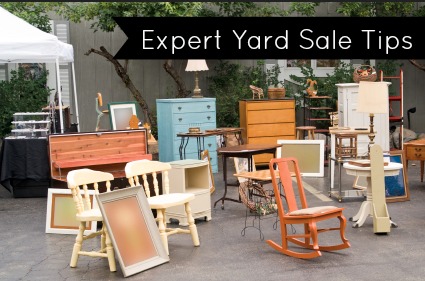
Find the location of a particular element. This screenshot has width=425, height=281. bar is located at coordinates (34, 130).